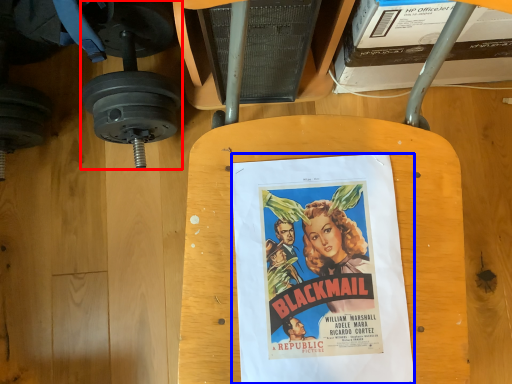
Question: Which of the following is the farthest to the observer, dumbbell (highlighted by a red box) or poster (highlighted by a blue box)?

Choices:
 (A) dumbbell
 (B) poster

Answer: (A)